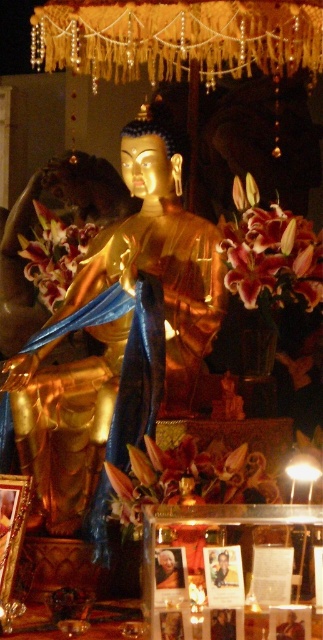
Question: Which object is farther from the camera taking this photo?

Choices:
 (A) gold polished statue at center
 (B) pink lily at left
 (C) pink silk lily at center
 (D) matte gold statue at center

Answer: (B)

Question: Does gold polished statue at center have a greater width compared to matte gold statue at center?

Choices:
 (A) no
 (B) yes

Answer: (B)

Question: Which point is closer to the camera?

Choices:
 (A) matte gold statue at center
 (B) gold polished statue at center
 (C) pink lily at left
 (D) pink silk lily at center

Answer: (A)

Question: Is gold polished statue at center thinner than matte gold statue at center?

Choices:
 (A) no
 (B) yes

Answer: (A)

Question: Which point is farther to the camera?

Choices:
 (A) (53, 252)
 (B) (230, 465)
 (C) (50, 384)

Answer: (A)

Question: Is pink silk lily at center closer to the viewer compared to matte gold statue at center?

Choices:
 (A) no
 (B) yes

Answer: (A)